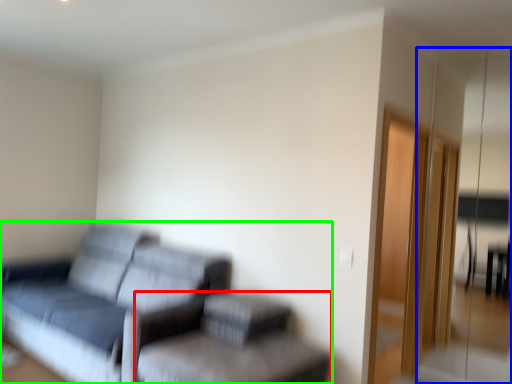
Question: Which object is the farthest from swivel chair (highlighted by a red box)? Choose among these: glass door (highlighted by a blue box) or studio couch (highlighted by a green box).

Choices:
 (A) glass door
 (B) studio couch

Answer: (A)